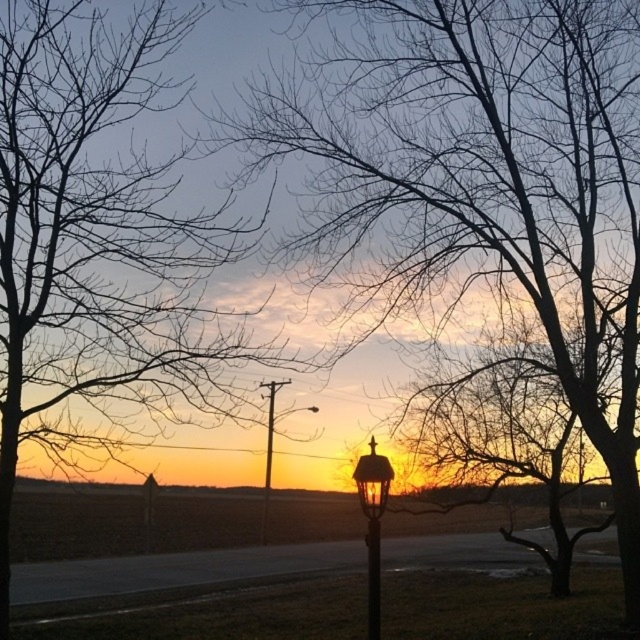
Which is more to the right, silhouette bare tree at center or silhouette bare tree at left?

From the viewer's perspective, silhouette bare tree at center appears more on the right side.

The height and width of the screenshot is (640, 640). Find the location of `silhouette bare tree at center`. silhouette bare tree at center is located at coordinates (477, 182).

Which of these two, silhouette bare tree at left or metallic streetlight at center, stands taller?

Standing taller between the two is silhouette bare tree at left.

Does silhouette bare tree at left lie behind metallic streetlight at center?

No, silhouette bare tree at left is in front of metallic streetlight at center.

Between point (81, 12) and point (273, 428), which one is positioned in front?

Point (81, 12) is in front.

I want to click on silhouette bare tree at left, so click(100, 243).

Describe the element at coordinates (372, 524) in the screenshot. I see `matte black lamp post at center` at that location.

Is matte black lamp post at center to the left of metallic streetlamp at center from the viewer's perspective?

Yes, matte black lamp post at center is to the left of metallic streetlamp at center.

Does point (374, 600) come behind point (380, 605)?

No.

This screenshot has width=640, height=640. What are the coordinates of `matte black lamp post at center` in the screenshot? It's located at (372, 524).